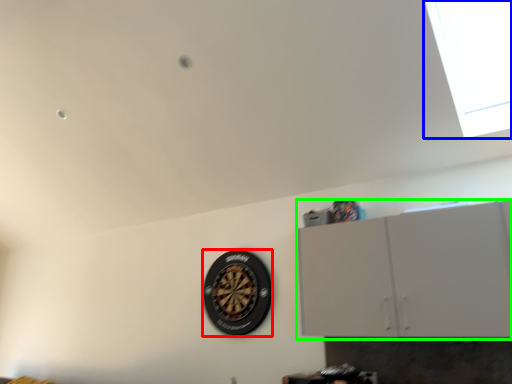
Question: Which is farther away from wheel (highlighted by a red box)? window (highlighted by a blue box) or cabinetry (highlighted by a green box)?

Choices:
 (A) window
 (B) cabinetry

Answer: (A)